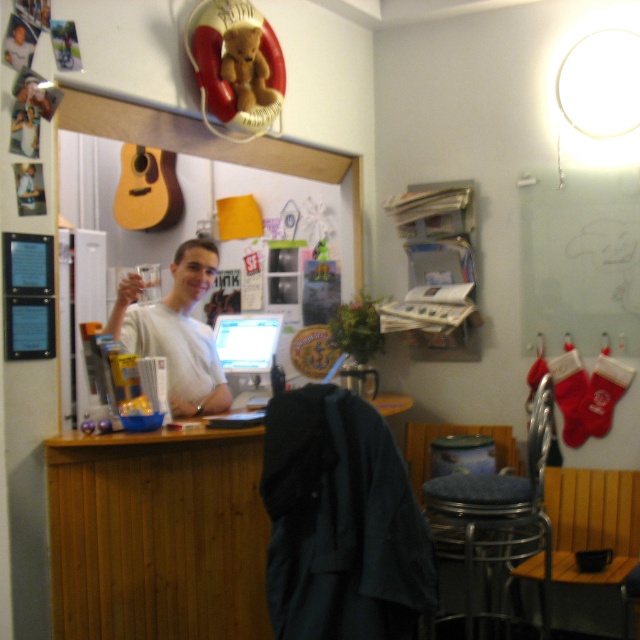
Who is positioned more to the right, wooden table at center or matte plastic computer at center?

Positioned to the right is matte plastic computer at center.

Does wooden table at center have a greater height compared to matte plastic computer at center?

Correct, wooden table at center is much taller as matte plastic computer at center.

Does point (90, 580) come closer to viewer compared to point (237, 404)?

Yes, it is in front of point (237, 404).

At what (x,y) coordinates should I click in order to perform the action: click on wooden table at center. Please return your answer as a coordinate pair (x, y). Looking at the image, I should click on (157, 534).

Is metallic stool at lower center positioned at the back of matte plastic computer at center?

No, metallic stool at lower center is closer to the viewer.

Does point (444, 483) come behind point (236, 317)?

No, it is not.

Is point (506, 508) behind point (241, 314)?

No, (506, 508) is in front of (241, 314).

Identify the location of metallic stool at lower center. The width and height of the screenshot is (640, 640). (486, 522).

Which is behind, point (204, 374) or point (266, 342)?

Positioned behind is point (266, 342).

From the picture: Is white matte shirt at center bigger than matte plastic computer at center?

Correct, white matte shirt at center is larger in size than matte plastic computer at center.

Is point (177, 397) positioned after point (256, 317)?

No.

Where is `white matte shirt at center`? white matte shirt at center is located at coordinates (177, 330).